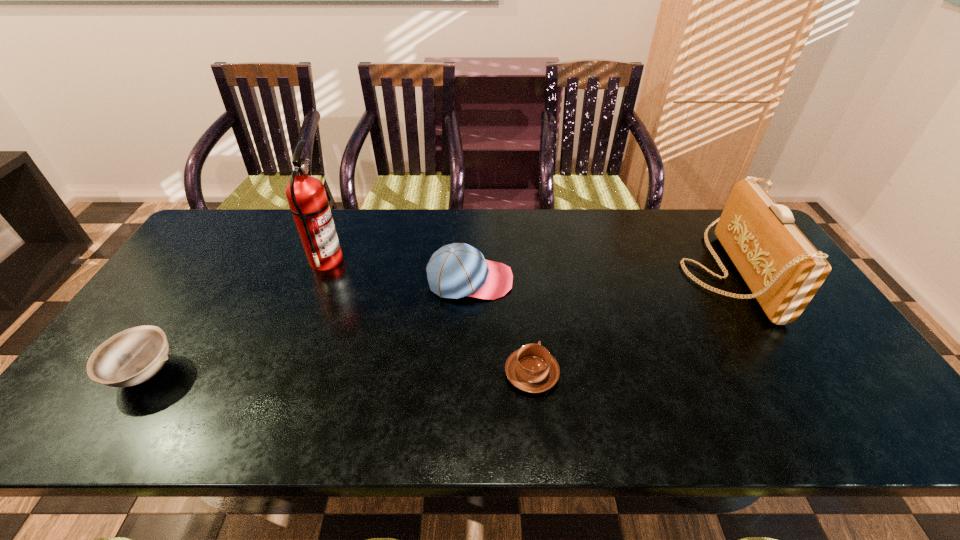
The image size is (960, 540). Identify the location of free space between the fourth object from right to left and the cappuccino. (429, 317).

Find the location of a particular element. The width and height of the screenshot is (960, 540). vacant area between the cappuccino and the second object from left to right is located at coordinates (429, 317).

You are a GUI agent. You are given a task and a screenshot of the screen. Output one action in this format:
    pyautogui.click(x=<x>, y=<y>)
    Task: Click on the free spot between the shortest object and the third tallest object
    
    Given the screenshot: What is the action you would take?
    pyautogui.click(x=501, y=327)

What are the coordinates of `vacant space that is in between the fire extinguisher and the cappuccino` in the screenshot? It's located at (429, 317).

What are the coordinates of `free spot between the tallest object and the handbag` in the screenshot? It's located at (525, 266).

Locate an element on the screen. vacant space that's between the fourth tallest object and the tallest object is located at coordinates (235, 316).

Where is `unoccupied position between the shortest object and the handbag`? Image resolution: width=960 pixels, height=540 pixels. unoccupied position between the shortest object and the handbag is located at coordinates (629, 322).

Locate which object is the closest to the third shortest object. Please provide its 2D coordinates. Your answer should be formatted as a tuple, i.e. [(x, y)], where the tuple contains the x and y coordinates of a point satisfying the conditions above.

[(532, 369)]

Where is `the fourth closest object to the fire extinguisher`? the fourth closest object to the fire extinguisher is located at coordinates (782, 268).

At what (x,y) coordinates should I click in order to perform the action: click on free spot that satisfies the following two spatial constraints: 1. at the nozzle of the tallest object; 2. on the front side of the bowl. Please return your answer as a coordinate pair (x, y). The image size is (960, 540). Looking at the image, I should click on (282, 373).